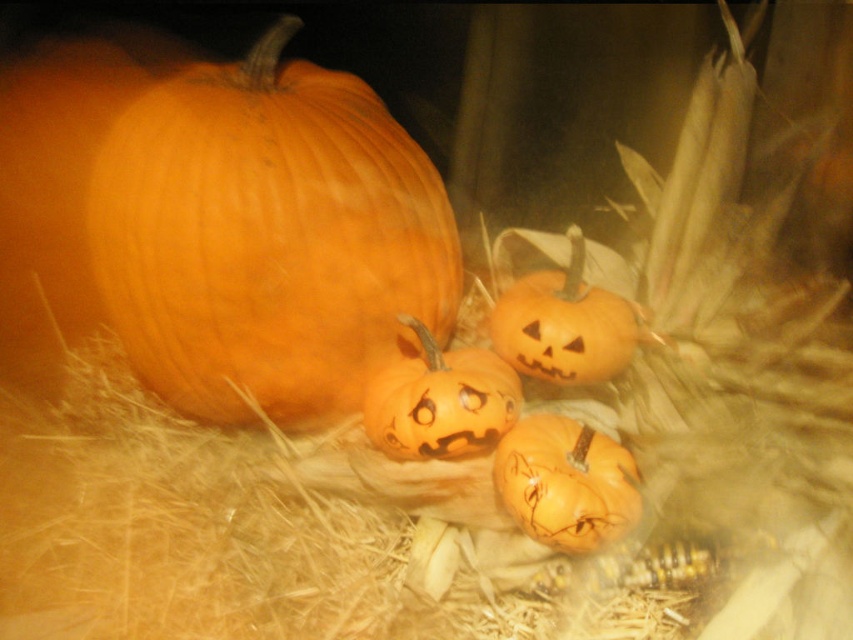
You are setting up a Halloween display and have two pumpkins to place on a narrow shelf. The shelf can only support items that are no more than 10 cm thick. You have the matte orange pumpkin at lower center and the orange matte pumpkin at center. Which pumpkin should you choose to ensure it fits on the shelf?

The matte orange pumpkin at lower center is thinner than the orange matte pumpkin at center, so it is more likely to fit on the shelf that can only support items up to 10 cm thick.

You are standing in front of the arrangement of pumpkins on the hay bed. You see the matte orange pumpkin at lower center and the matte orange pumpkin at center. Which one is positioned lower in the image?

The matte orange pumpkin at lower center is positioned lower than the matte orange pumpkin at center.

You have a wooden crate that can only hold pumpkins wider than 12 inches. You see the orange matte pumpkin at left and the matte orange pumpkin at center. Which pumpkin should you place in the crate to ensure it fits?

The orange matte pumpkin at left should be placed in the crate because it might be wider than the matte orange pumpkin at center, and if it exceeds 12 inches, it will fit.